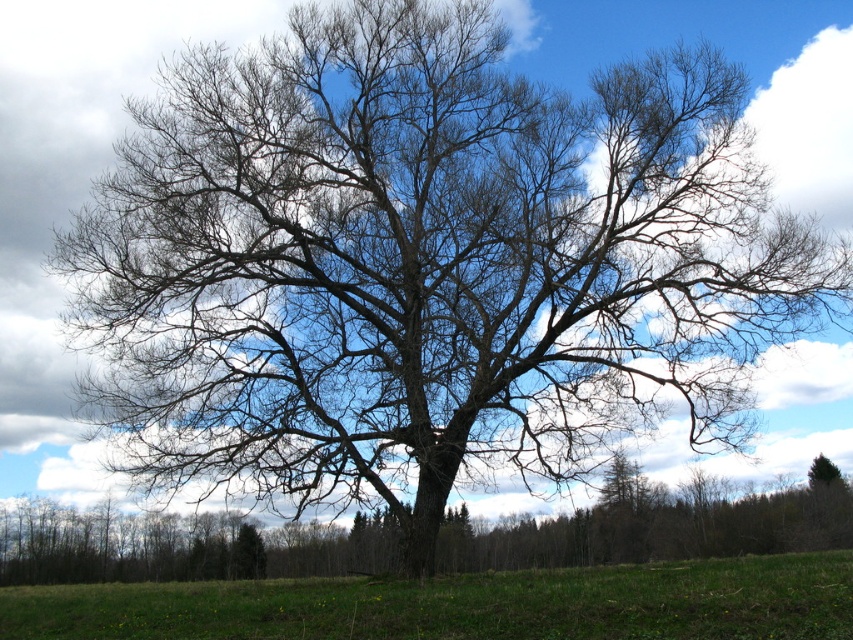
Who is positioned more to the right, green grassy field at center or bare wood tree at center?

bare wood tree at center

Does green grassy field at center have a larger size compared to bare wood tree at center?

Yes, green grassy field at center is bigger than bare wood tree at center.

Is point (258, 620) positioned after point (682, 518)?

No, (258, 620) is in front of (682, 518).

Image resolution: width=853 pixels, height=640 pixels. Identify the location of green grassy field at center. (463, 604).